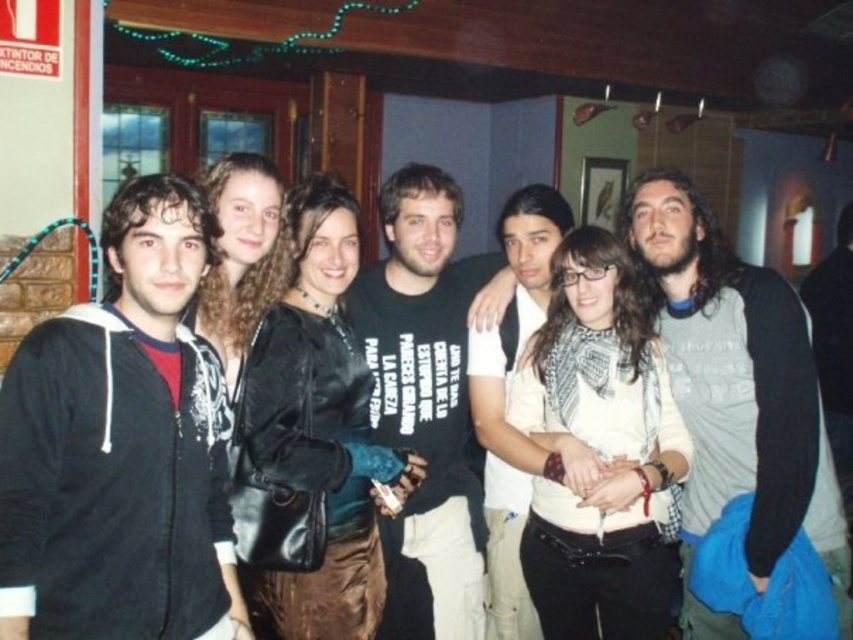
Between black hoodie at center and black cotton t-shirt at center, which one is positioned lower?

Positioned lower is black cotton t-shirt at center.

Is black hoodie at center in front of black cotton t-shirt at center?

Yes, it is.

Is point (113, 433) farther from viewer compared to point (392, 232)?

No.

Locate an element on the screen. The image size is (853, 640). black hoodie at center is located at coordinates (119, 449).

Does gray cotton t-shirt at center appear on the right side of black cotton t-shirt at center?

Correct, you'll find gray cotton t-shirt at center to the right of black cotton t-shirt at center.

Looking at this image, can you confirm if gray cotton t-shirt at center is positioned below black cotton t-shirt at center?

Yes, gray cotton t-shirt at center is below black cotton t-shirt at center.

Locate an element on the screen. gray cotton t-shirt at center is located at coordinates (738, 381).

Which of these two, black hoodie at center or gray cotton t-shirt at center, stands taller?

gray cotton t-shirt at center

Is black hoodie at center wider than gray cotton t-shirt at center?

In fact, black hoodie at center might be narrower than gray cotton t-shirt at center.

At what (x,y) coordinates should I click in order to perform the action: click on black hoodie at center. Please return your answer as a coordinate pair (x, y). Image resolution: width=853 pixels, height=640 pixels. Looking at the image, I should click on (119, 449).